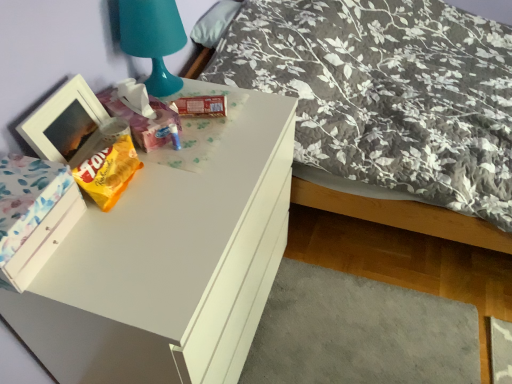
Question: From their relative heights in the image, would you say matte plastic tissue box at upper center, which is the 1th package in left-to-right order, is taller or shorter than floral fabric bed at upper right?

Choices:
 (A) tall
 (B) short

Answer: (B)

Question: Does point pyautogui.click(x=133, y=114) appear closer or farther from the camera than point pyautogui.click(x=184, y=74)?

Choices:
 (A) closer
 (B) farther

Answer: (A)

Question: Considering the real-world distances, which object is farthest from the floral fabric bed at upper right?

Choices:
 (A) white matte picture frame at left
 (B) yellow matte snack packet at left
 (C) white glossy desk at upper left
 (D) teal plastic table lamp at upper left
 (E) fluffy gray pillow at upper center

Answer: (A)

Question: Based on their relative distances, which object is farther from the floral fabric bed at upper right?

Choices:
 (A) white matte picture frame at left
 (B) white glossy desk at upper left
 (C) matte brown package at upper center, which is the second package in left-to-right order
 (D) fluffy gray pillow at upper center
 (E) yellow matte snack packet at left

Answer: (A)